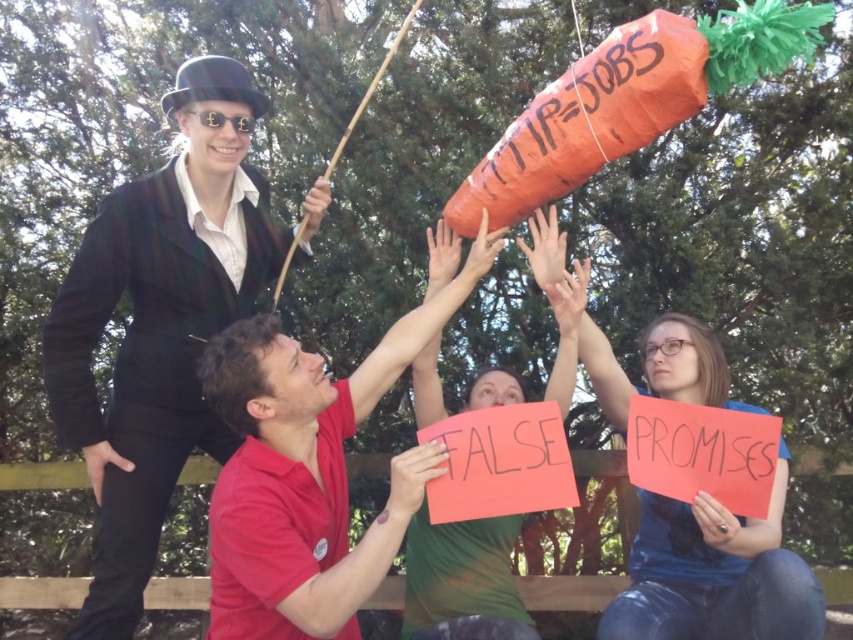
Question: Which point is farther to the camera?

Choices:
 (A) (123, 364)
 (B) (273, 609)

Answer: (A)

Question: Which of the following is the farthest from the observer?

Choices:
 (A) blue denim jeans at lower right
 (B) green fabric shirt at center
 (C) red cotton shirt at center

Answer: (B)

Question: Does red cotton shirt at center appear under green fabric shirt at center?

Choices:
 (A) no
 (B) yes

Answer: (A)

Question: Where is red cotton shirt at center located in relation to green fabric shirt at center in the image?

Choices:
 (A) left
 (B) right

Answer: (A)

Question: Can you confirm if matte black suit at upper left is positioned below blue denim jeans at lower right?

Choices:
 (A) no
 (B) yes

Answer: (A)

Question: Which object is farther from the camera taking this photo?

Choices:
 (A) blue denim jeans at lower right
 (B) red cotton shirt at center
 (C) green fabric shirt at center
 (D) matte black suit at upper left

Answer: (D)